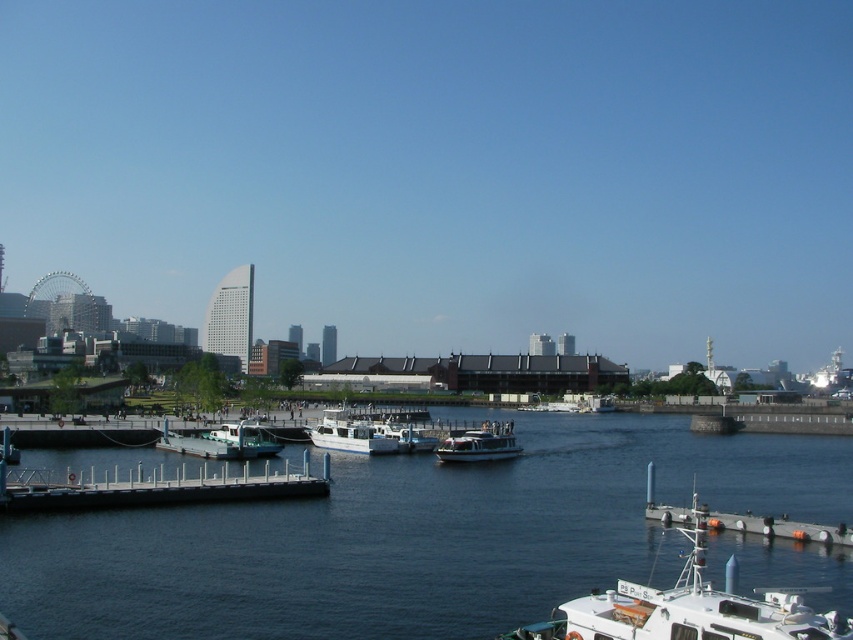
Does blue water at center have a smaller size compared to white wooden dock at lower left?

Actually, blue water at center might be larger than white wooden dock at lower left.

Who is positioned more to the left, blue water at center or white wooden dock at lower left?

white wooden dock at lower left is more to the left.

Is point (26, 563) positioned in front of point (99, 508)?

That is True.

This screenshot has height=640, width=853. In order to click on blue water at center in this screenshot , I will do `click(407, 536)`.

Is white matte boat at lower right to the right of white matte boat at center from the viewer's perspective?

Indeed, white matte boat at lower right is positioned on the right side of white matte boat at center.

Is white matte boat at lower right thinner than white matte boat at center?

No.

Is point (659, 618) positioned before point (339, 449)?

Yes, it is in front of point (339, 449).

The height and width of the screenshot is (640, 853). Identify the location of white matte boat at lower right. (689, 608).

Is white matte boat at lower right in front of metallic silver boat at center-left?

That is True.

Can you confirm if white matte boat at lower right is wider than metallic silver boat at center-left?

No.

Who is more forward, (x=671, y=604) or (x=227, y=454)?

Point (x=671, y=604)

Image resolution: width=853 pixels, height=640 pixels. I want to click on white matte boat at lower right, so click(x=689, y=608).